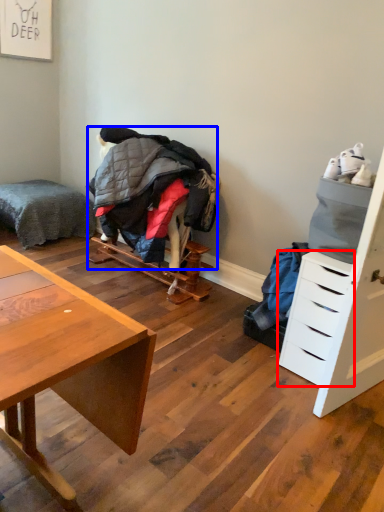
Question: Which object appears farthest to the camera in this image, drawer (highlighted by a red box) or clothing (highlighted by a blue box)?

Choices:
 (A) drawer
 (B) clothing

Answer: (B)